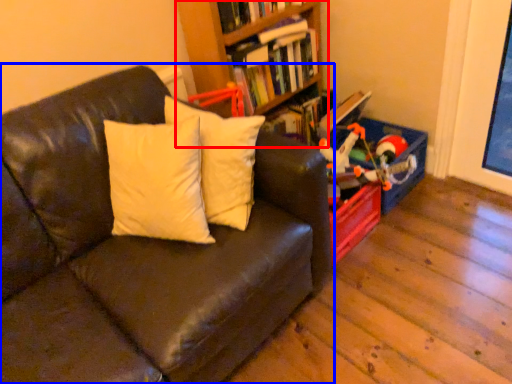
Question: Among these objects, which one is nearest to the camera, bookcase (highlighted by a red box) or studio couch (highlighted by a blue box)?

Choices:
 (A) bookcase
 (B) studio couch

Answer: (B)